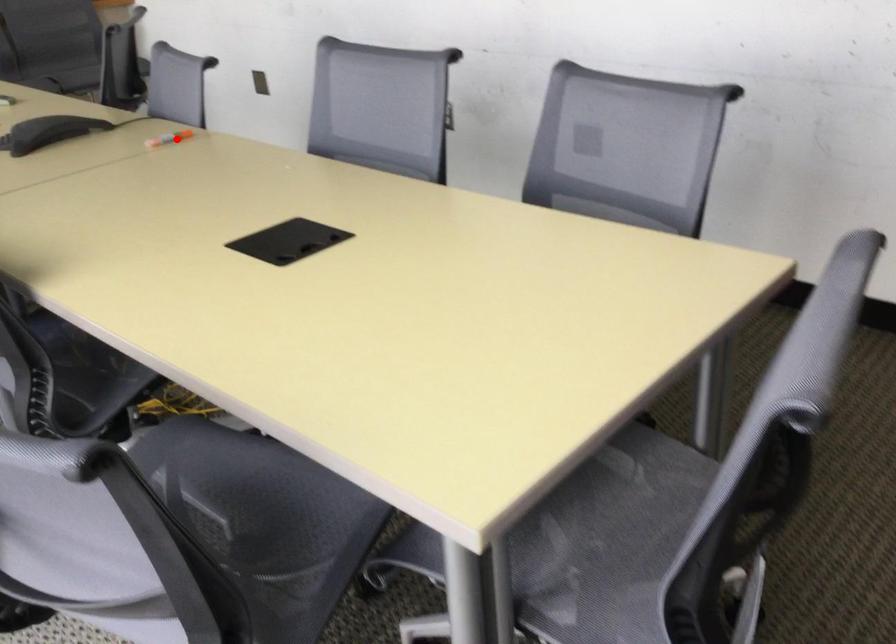
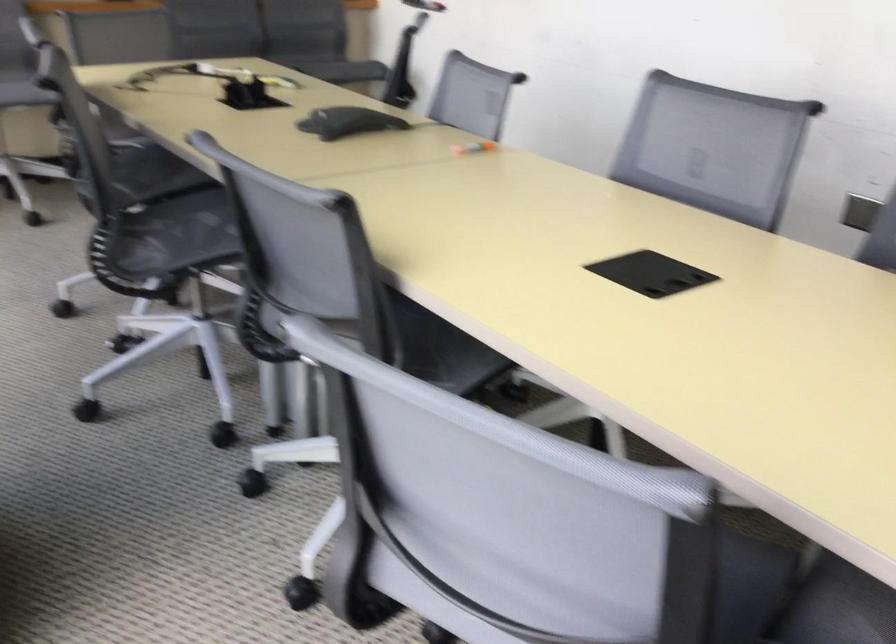
Question: I am providing you with two images of the same scene from different viewpoints. A red point is marked on the first image. At the location where the point appears in image 1, is it still visible in image 2?

Choices:
 (A) Yes
 (B) No

Answer: (A)